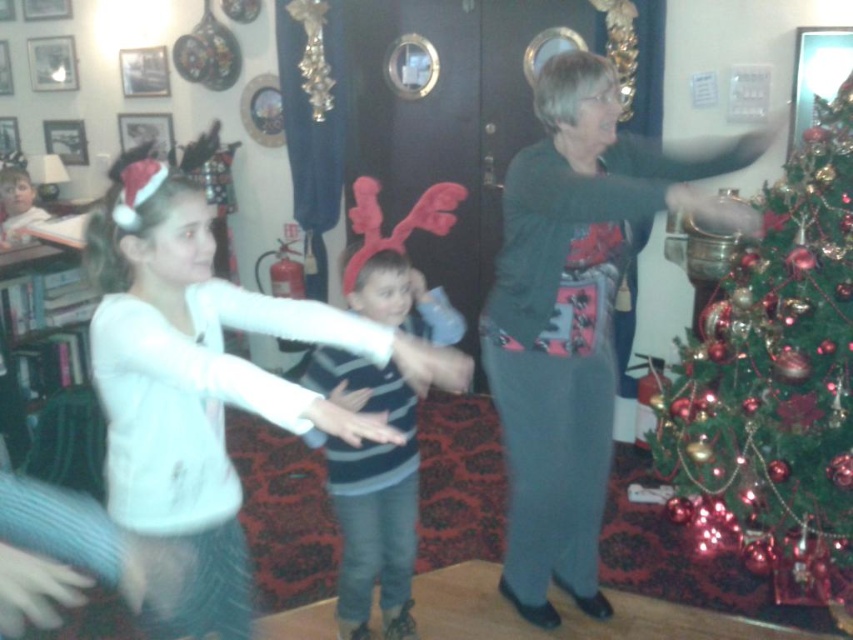
Is point (120, 196) farther from viewer compared to point (671, 445)?

No, it is not.

Is point (200, 308) positioned before point (701, 499)?

Yes, it is in front of point (701, 499).

Which is behind, point (140, 205) or point (834, 522)?

Positioned behind is point (834, 522).

The image size is (853, 640). I want to click on white matte sweater at center, so click(206, 378).

Does white matte sweater at center have a lesser height compared to striped knit sweater at center?

In fact, white matte sweater at center may be taller than striped knit sweater at center.

Which is behind, point (160, 412) or point (398, 307)?

The point (398, 307) is more distant.

What are the coordinates of `white matte sweater at center` in the screenshot? It's located at (206, 378).

Is point (537, 225) positioned behind point (836, 435)?

That is False.

Is point (543, 243) in front of point (766, 499)?

Yes, point (543, 243) is in front of point (766, 499).

This screenshot has height=640, width=853. Identify the location of dark gray sweater at center. (576, 314).